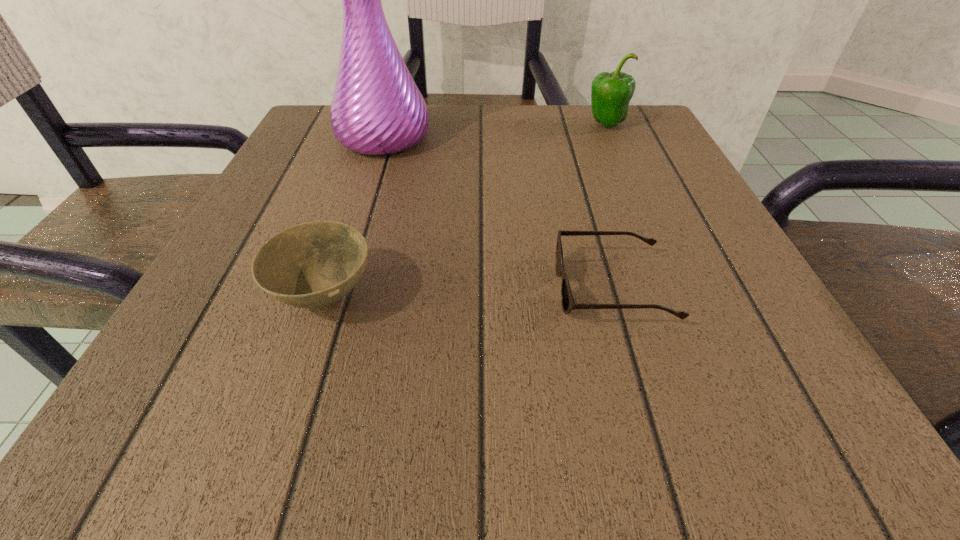
Locate an element on the screen. The width and height of the screenshot is (960, 540). vase is located at coordinates (377, 109).

I want to click on the second tallest object, so click(x=611, y=93).

You are a GUI agent. You are given a task and a screenshot of the screen. Output one action in this format:
    pyautogui.click(x=<x>, y=<y>)
    Task: Click on the second shortest object
    This screenshot has width=960, height=540.
    Given the screenshot: What is the action you would take?
    pyautogui.click(x=312, y=265)

At what (x,y) coordinates should I click in order to perform the action: click on the shortest object. Please return your answer as a coordinate pair (x, y). The image size is (960, 540). Looking at the image, I should click on (568, 304).

Where is `vacant space located 0.070m on the front of the tallest object`? Image resolution: width=960 pixels, height=540 pixels. vacant space located 0.070m on the front of the tallest object is located at coordinates (370, 184).

Find the location of `blank area located 0.180m on the front of the third shortest object`. blank area located 0.180m on the front of the third shortest object is located at coordinates (632, 183).

Identify the location of free region located on the right of the bowl. The image size is (960, 540). (483, 296).

This screenshot has width=960, height=540. I want to click on free space located on the front lenses of the sunglasses, so click(x=439, y=289).

This screenshot has height=540, width=960. What are the coordinates of `free space located 0.250m on the front lenses of the sunglasses` in the screenshot? It's located at (371, 289).

Find the location of `free space located 0.050m on the front lenses of the sunglasses`. free space located 0.050m on the front lenses of the sunglasses is located at coordinates (521, 289).